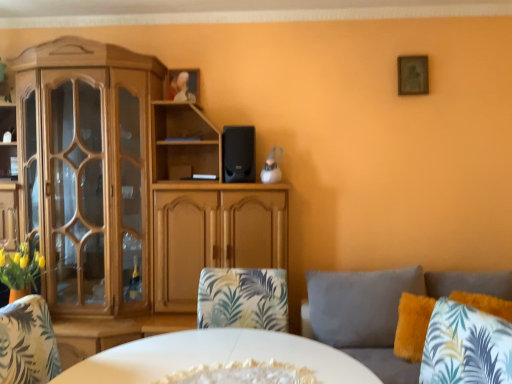
Question: In the image, is fluffy yellow pillow at lower right on the left side or the right side of wooden cabinet at left?

Choices:
 (A) right
 (B) left

Answer: (A)

Question: Considering the positions of fluffy yellow pillow at lower right and wooden cabinet at left in the image, is fluffy yellow pillow at lower right taller or shorter than wooden cabinet at left?

Choices:
 (A) tall
 (B) short

Answer: (B)

Question: Which of these objects is positioned farthest from the fluffy yellow pillow at lower right?

Choices:
 (A) fluffy gray couch at right
 (B) white glossy plate at center
 (C) wooden cabinet at left
 (D) wooden picture frame at upper right
 (E) black matte speaker at center

Answer: (C)

Question: Based on their relative distances, which object is farther from the wooden picture frame at upper right?

Choices:
 (A) wooden cabinet at left
 (B) black matte speaker at center
 (C) fluffy gray couch at right
 (D) white glossy plate at center
 (E) fluffy yellow pillow at lower right

Answer: (D)